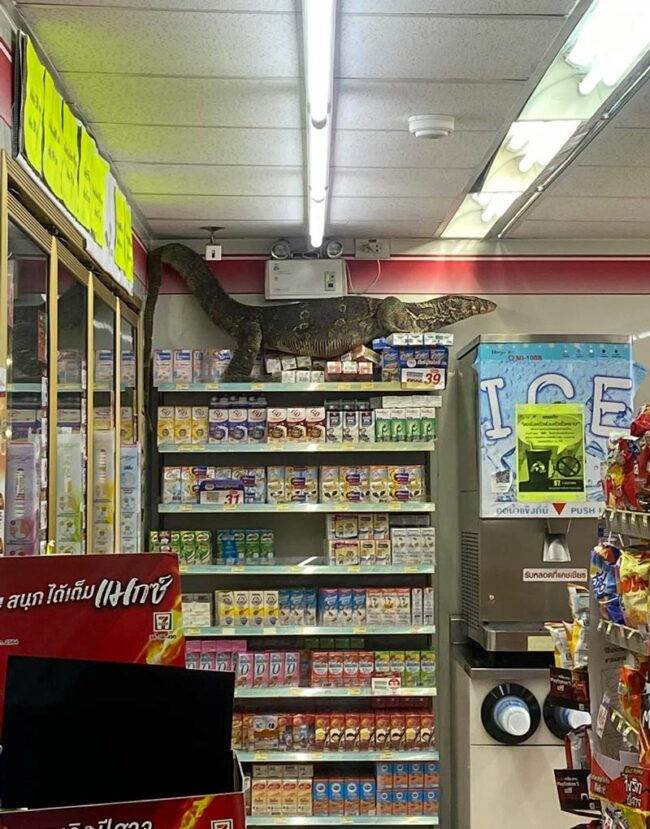
This screenshot has width=650, height=829. Identify the location of ice machine. (495, 550).